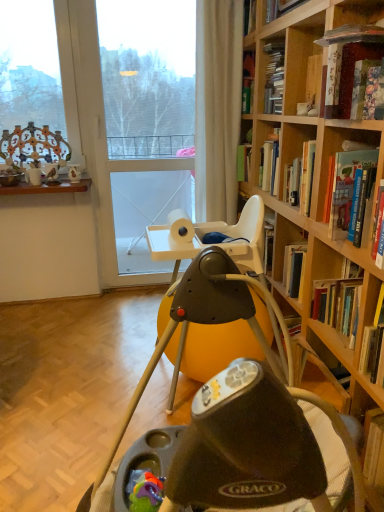
Question: Are hardcover book at upper right, placed as the second book when sorted from bottom to top, and transparent glass door at center making contact?

Choices:
 (A) no
 (B) yes

Answer: (A)

Question: Is hardcover book at upper right, placed as the second book when sorted from bottom to top, oriented towards transparent glass door at center?

Choices:
 (A) no
 (B) yes

Answer: (A)

Question: Considering the relative sizes of hardcover book at upper right, placed as the second book when sorted from bottom to top, and transparent glass door at center in the image provided, is hardcover book at upper right, placed as the second book when sorted from bottom to top, taller than transparent glass door at center?

Choices:
 (A) no
 (B) yes

Answer: (A)

Question: Considering the relative sizes of hardcover book at upper right, placed as the second book when sorted from bottom to top, and transparent glass door at center in the image provided, is hardcover book at upper right, placed as the second book when sorted from bottom to top, shorter than transparent glass door at center?

Choices:
 (A) yes
 (B) no

Answer: (A)

Question: Is hardcover book at upper right, the second book in the top-to-bottom sequence, positioned before transparent glass door at center?

Choices:
 (A) yes
 (B) no

Answer: (A)

Question: Considering the positions of matte white cup at upper left and hardcover book at upper right, the 1th book in the bottom-to-top sequence, in the image, is matte white cup at upper left bigger or smaller than hardcover book at upper right, the 1th book in the bottom-to-top sequence,?

Choices:
 (A) small
 (B) big

Answer: (A)

Question: From a real-world perspective, is matte white cup at upper left above or below hardcover book at upper right, the 1th book in the bottom-to-top sequence?

Choices:
 (A) below
 (B) above

Answer: (A)

Question: Is point (33, 175) closer or farther from the camera than point (329, 220)?

Choices:
 (A) closer
 (B) farther

Answer: (B)

Question: Based on their positions, is matte white cup at upper left located to the left or right of hardcover book at upper right, the 1th book in the bottom-to-top sequence?

Choices:
 (A) right
 (B) left

Answer: (B)

Question: In terms of size, does matte glass window at upper left appear bigger or smaller than beige fabric curtain at upper center?

Choices:
 (A) small
 (B) big

Answer: (A)

Question: In the image, is matte glass window at upper left positioned in front of or behind beige fabric curtain at upper center?

Choices:
 (A) front
 (B) behind

Answer: (B)

Question: Is matte glass window at upper left wider or thinner than beige fabric curtain at upper center?

Choices:
 (A) wide
 (B) thin

Answer: (B)

Question: Considering the positions of point (1, 57) and point (223, 10), is point (1, 57) closer or farther from the camera than point (223, 10)?

Choices:
 (A) farther
 (B) closer

Answer: (A)

Question: Is hardcover book at upper right, the 1th book in the bottom-to-top sequence, wider or thinner than matte black swing at center?

Choices:
 (A) thin
 (B) wide

Answer: (A)

Question: Is hardcover book at upper right, which is the 3th book in top-to-bottom order, to the left or to the right of matte black swing at center in the image?

Choices:
 (A) left
 (B) right

Answer: (B)